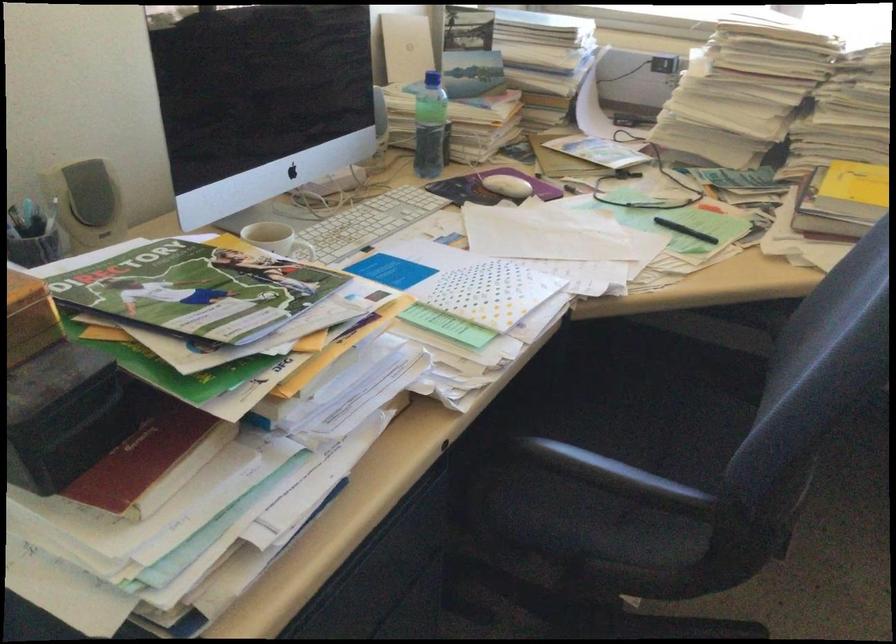
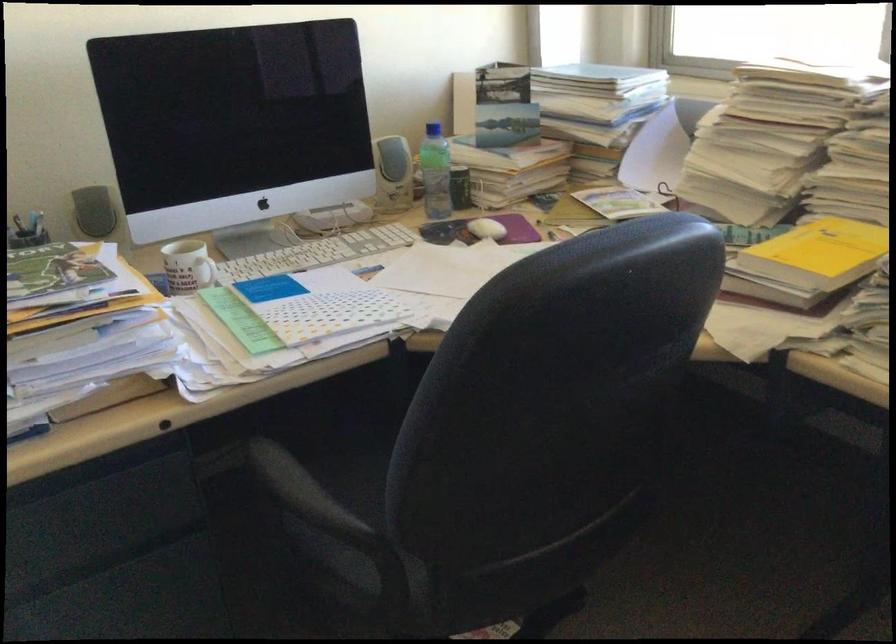
Question: I am providing you with two images of the same scene from different viewpoints. Which of the following objects are not visible in image2?

Choices:
 (A) white mug handle
 (B) black eraser handle
 (C) chair sitting surface
 (D) grey speaker

Answer: (C)